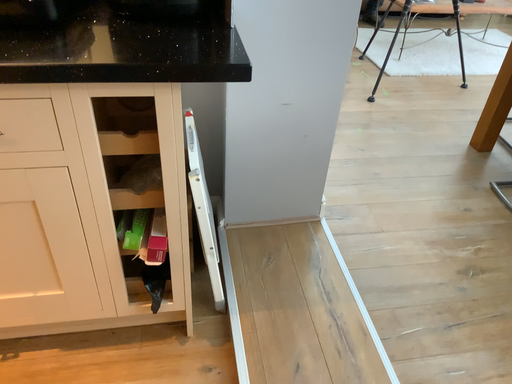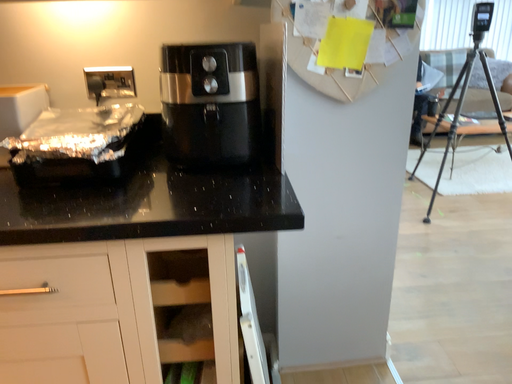
Question: Which way did the camera rotate in the video?

Choices:
 (A) rotated downward
 (B) rotated upward

Answer: (B)